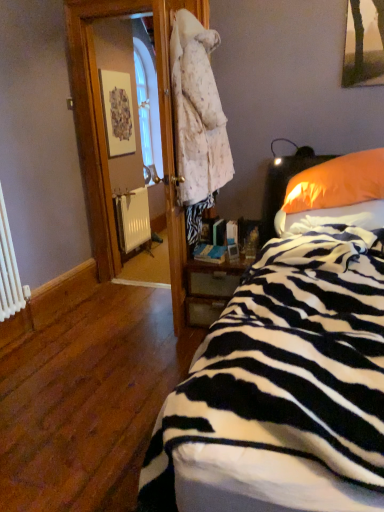
Question: Is wooden nightstand at center at the back of zebra-patterned fabric at lower right?

Choices:
 (A) no
 (B) yes

Answer: (A)

Question: Does zebra-patterned fabric at lower right have a larger size compared to wooden nightstand at center?

Choices:
 (A) no
 (B) yes

Answer: (B)

Question: Does zebra-patterned fabric at lower right have a greater width compared to wooden nightstand at center?

Choices:
 (A) yes
 (B) no

Answer: (A)

Question: From the image's perspective, is zebra-patterned fabric at lower right above wooden nightstand at center?

Choices:
 (A) yes
 (B) no

Answer: (B)

Question: Is zebra-patterned fabric at lower right completely or partially outside of wooden nightstand at center?

Choices:
 (A) no
 (B) yes

Answer: (B)

Question: Considering the positions of white matte radiator at lower left and zebra-patterned fabric at lower right in the image, is white matte radiator at lower left bigger or smaller than zebra-patterned fabric at lower right?

Choices:
 (A) big
 (B) small

Answer: (B)

Question: From a real-world perspective, is white matte radiator at lower left positioned above or below zebra-patterned fabric at lower right?

Choices:
 (A) below
 (B) above

Answer: (A)

Question: Is point (124, 196) positioned closer to the camera than point (253, 327)?

Choices:
 (A) farther
 (B) closer

Answer: (A)

Question: In terms of height, does white matte radiator at lower left look taller or shorter compared to zebra-patterned fabric at lower right?

Choices:
 (A) short
 (B) tall

Answer: (A)

Question: Visually, is zebra-patterned fabric at lower right positioned to the left or to the right of orange fabric pillow at right?

Choices:
 (A) right
 (B) left

Answer: (B)

Question: Considering their positions, is zebra-patterned fabric at lower right located in front of or behind orange fabric pillow at right?

Choices:
 (A) behind
 (B) front

Answer: (B)

Question: Is point (344, 350) closer or farther from the camera than point (306, 226)?

Choices:
 (A) farther
 (B) closer

Answer: (B)

Question: From a real-world perspective, relative to orange fabric pillow at right, is zebra-patterned fabric at lower right vertically above or below?

Choices:
 (A) above
 (B) below

Answer: (B)

Question: Considering the positions of wooden picture frame at upper left and wooden nightstand at center in the image, is wooden picture frame at upper left bigger or smaller than wooden nightstand at center?

Choices:
 (A) small
 (B) big

Answer: (A)

Question: From their relative heights in the image, would you say wooden picture frame at upper left is taller or shorter than wooden nightstand at center?

Choices:
 (A) tall
 (B) short

Answer: (A)